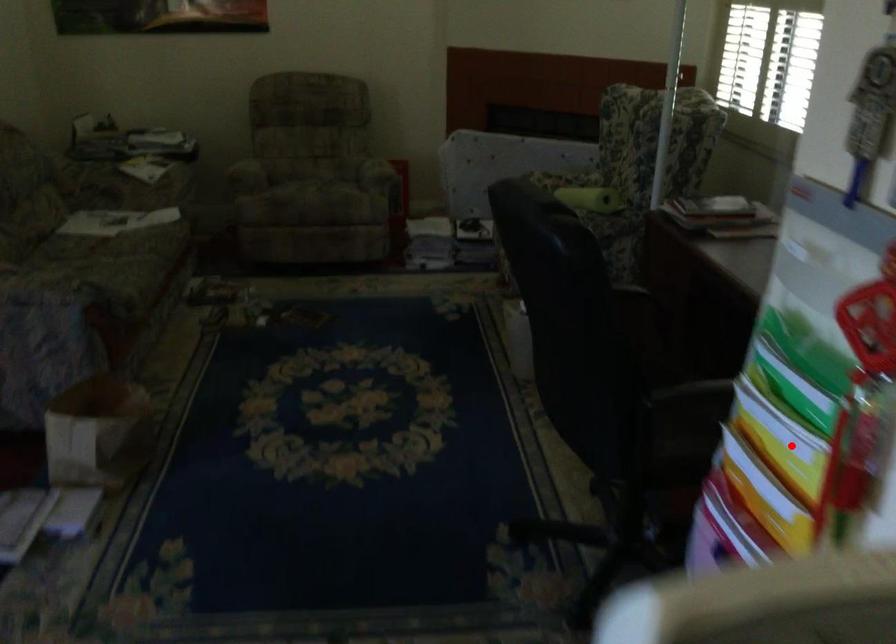
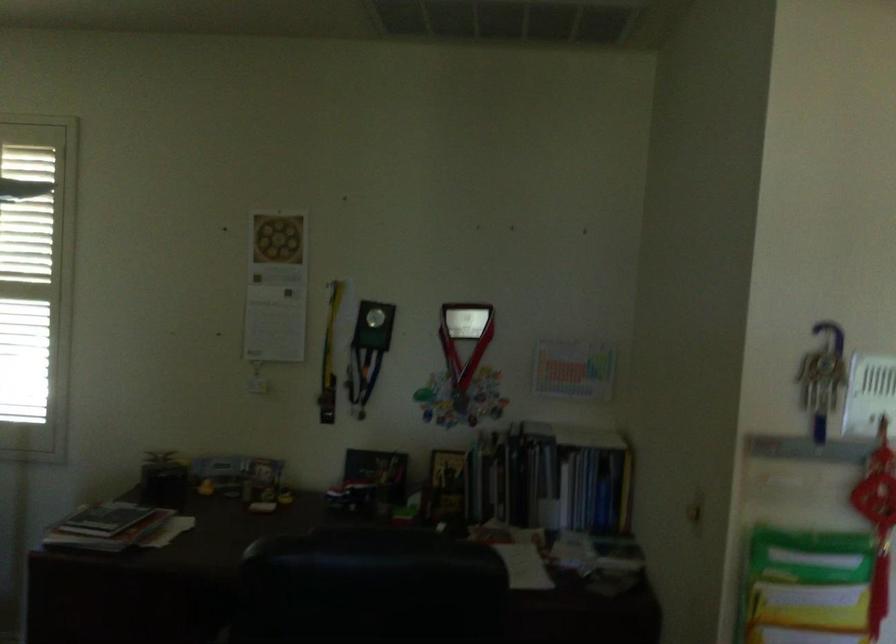
Question: I am providing you with two images of the same scene from different viewpoints. A red point is shown in image1. For the corresponding object point in image2, is it positioned nearer or farther from the camera?

Choices:
 (A) Nearer
 (B) Farther

Answer: (B)